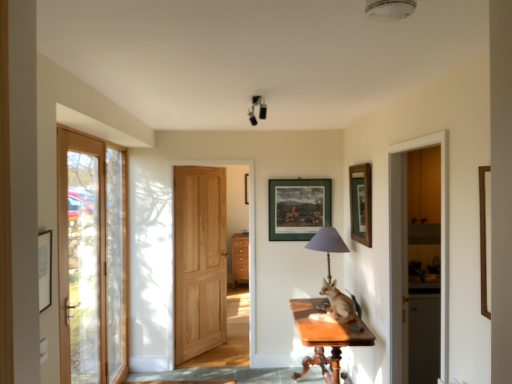
Question: Is clear glass door at left, the first door in the front-to-back sequence, not close to green matte picture frame at center, which is the 1th picture frame in left-to-right order?

Choices:
 (A) no
 (B) yes

Answer: (B)

Question: Could you tell me if clear glass door at left, the first door in the front-to-back sequence, is facing green matte picture frame at center, marked as the 2th picture frame in a front-to-back arrangement?

Choices:
 (A) yes
 (B) no

Answer: (B)

Question: Is clear glass door at left, the first door in the front-to-back sequence, outside of green matte picture frame at center, the 2th picture frame in the right-to-left sequence?

Choices:
 (A) yes
 (B) no

Answer: (A)

Question: Considering the relative positions of clear glass door at left, placed as the first door when sorted from left to right, and green matte picture frame at center, the 2th picture frame in the right-to-left sequence, in the image provided, is clear glass door at left, placed as the first door when sorted from left to right, in front of green matte picture frame at center, the 2th picture frame in the right-to-left sequence,?

Choices:
 (A) yes
 (B) no

Answer: (A)

Question: Is green matte picture frame at center, which is the first picture frame from back to front, located within clear glass door at left, the second door viewed from the right?

Choices:
 (A) yes
 (B) no

Answer: (B)

Question: Considering the relative sizes of clear glass door at left, the first door in the front-to-back sequence, and green matte picture frame at center, the 2th picture frame in the right-to-left sequence, in the image provided, is clear glass door at left, the first door in the front-to-back sequence, taller than green matte picture frame at center, the 2th picture frame in the right-to-left sequence,?

Choices:
 (A) yes
 (B) no

Answer: (A)

Question: Is light brown fur at center far from wooden picture frame at upper right, which is the 2th picture frame in back-to-front order?

Choices:
 (A) yes
 (B) no

Answer: (B)

Question: Is light brown fur at center shorter than wooden picture frame at upper right, which is the 2th picture frame in back-to-front order?

Choices:
 (A) yes
 (B) no

Answer: (A)

Question: From a real-world perspective, is light brown fur at center below wooden picture frame at upper right, arranged as the 2th picture frame when viewed from the left?

Choices:
 (A) yes
 (B) no

Answer: (A)

Question: From the image's perspective, would you say light brown fur at center is positioned over wooden picture frame at upper right, which is the 2th picture frame in back-to-front order?

Choices:
 (A) no
 (B) yes

Answer: (A)

Question: Considering the relative sizes of light brown fur at center and wooden picture frame at upper right, arranged as the 2th picture frame when viewed from the left, in the image provided, is light brown fur at center taller than wooden picture frame at upper right, arranged as the 2th picture frame when viewed from the left,?

Choices:
 (A) no
 (B) yes

Answer: (A)

Question: Can you confirm if light brown fur at center is smaller than wooden picture frame at upper right, arranged as the 2th picture frame when viewed from the left?

Choices:
 (A) no
 (B) yes

Answer: (A)

Question: Is clear glass door at left, the second door viewed from the right, behind smooth stone path at lower center?

Choices:
 (A) yes
 (B) no

Answer: (B)